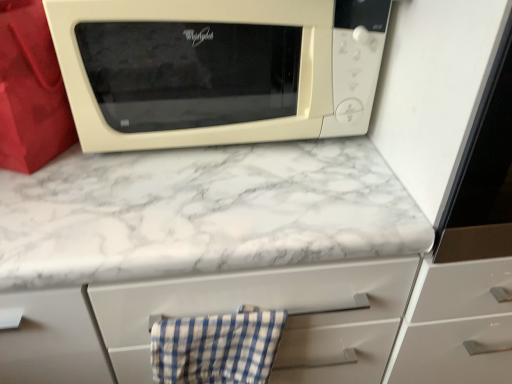
Find the location of a particular element. This screenshot has height=384, width=512. free space in front of beige matte microwave at upper center is located at coordinates (214, 205).